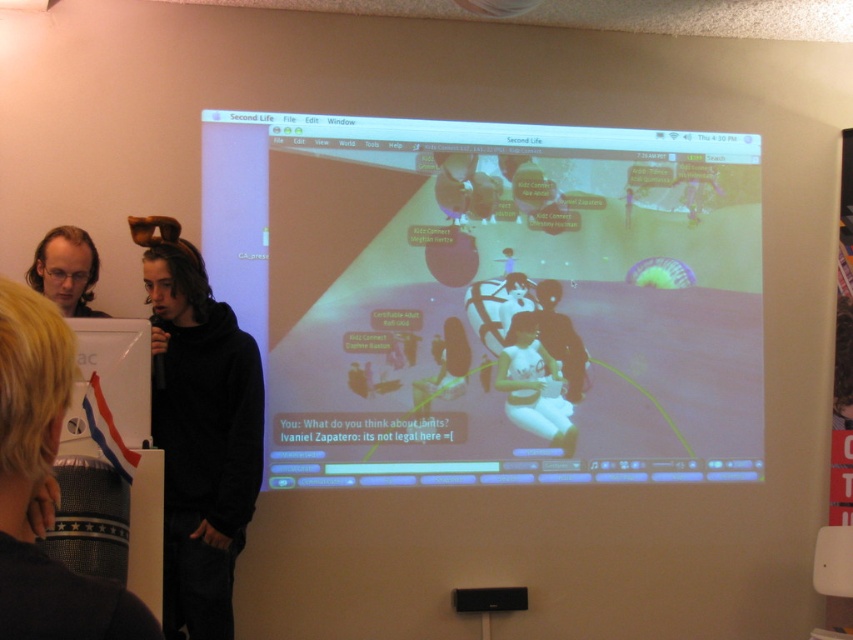
You are standing in the room where the presentation is happening. You want to move from point A at point (743, 445) to point B at point (86, 276). Which direction should you move to get closer to the camera?

To move from point A at point (743, 445) to point B at point (86, 276) and get closer to the camera, you should move towards point B. Since point A is further from the camera than point B, moving towards point B will bring you closer to the camera.

You are organizing a fashion show and need to arrange the white matte dress at center and the matte black hair at upper left in a way that highlights their size differences. Which object should be placed in a position where size matters most?

The white matte dress at center, which is smaller, should be placed in a position where its size can be emphasized, while the matte black hair at upper left can be positioned to complement it due to its larger size.

You are attending a virtual reality conference and notice the matte plastic screen at center and the matte black hair at upper left. Which object occupies more space in the scene?

The matte plastic screen at center has a larger size compared to the matte black hair at upper left, so it occupies more space in the scene.